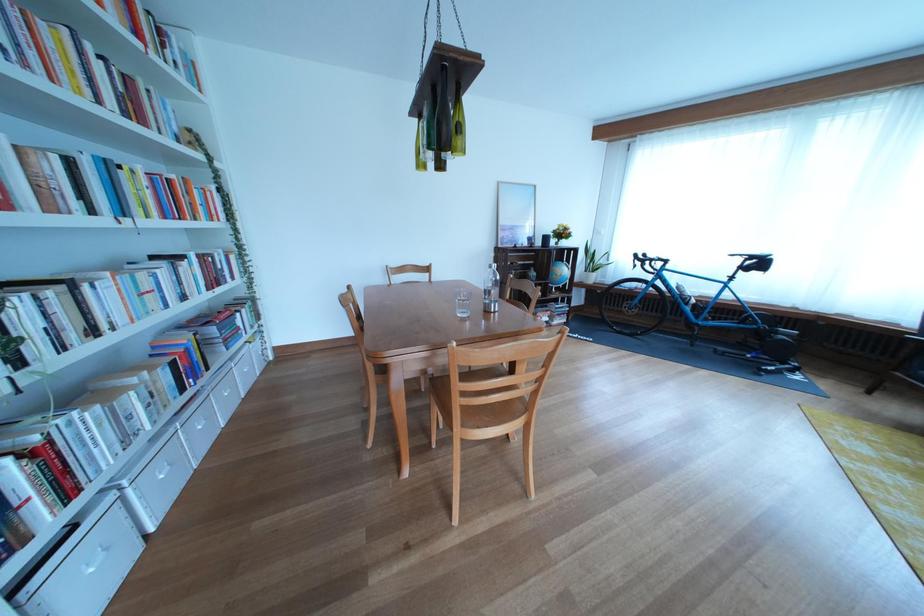
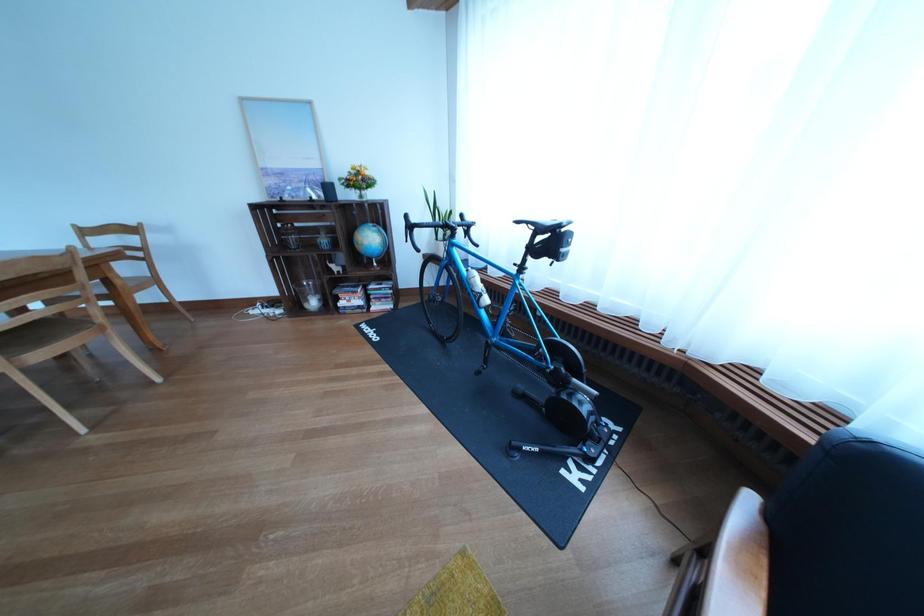
Find the pixel in the second image that matches (x=577, y=277) in the first image.

(383, 244)